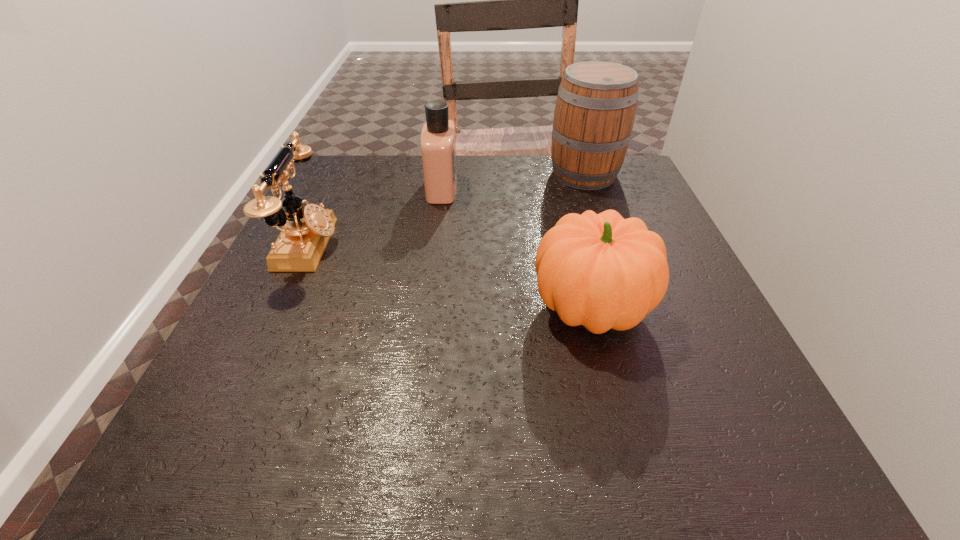
In order to click on object that is the third closest to the cider in this screenshot , I will do `click(305, 232)`.

Find the location of a particular element. the second closest object to the pumpkin is located at coordinates (595, 110).

I want to click on vacant region that satisfies the following two spatial constraints: 1. on the back side of the cider; 2. on the left side of the pumpkin, so click(557, 174).

Find the location of a particular element. free space that satisfies the following two spatial constraints: 1. on the front label of the pumpkin; 2. on the left side of the second object from left to right is located at coordinates (427, 308).

Identify the location of vacant position in the image that satisfies the following two spatial constraints: 1. on the back side of the pumpkin; 2. on the dial of the leftmost object. This screenshot has height=540, width=960. [x=575, y=245].

At what (x,y) coordinates should I click in order to perform the action: click on vacant space that satisfies the following two spatial constraints: 1. on the dial of the telephone; 2. on the left side of the pumpkin. Please return your answer as a coordinate pair (x, y). The width and height of the screenshot is (960, 540). Looking at the image, I should click on (279, 308).

The width and height of the screenshot is (960, 540). Find the location of `free space that satisfies the following two spatial constraints: 1. on the back side of the pumpkin; 2. on the dial of the telephone`. free space that satisfies the following two spatial constraints: 1. on the back side of the pumpkin; 2. on the dial of the telephone is located at coordinates (575, 245).

This screenshot has width=960, height=540. Find the location of `vacant space that satisfies the following two spatial constraints: 1. on the dial of the pumpkin; 2. on the left side of the leftmost object`. vacant space that satisfies the following two spatial constraints: 1. on the dial of the pumpkin; 2. on the left side of the leftmost object is located at coordinates (279, 308).

Where is `free space that satisfies the following two spatial constraints: 1. on the front label of the perfume; 2. on the left side of the pumpkin`? free space that satisfies the following two spatial constraints: 1. on the front label of the perfume; 2. on the left side of the pumpkin is located at coordinates (427, 308).

Identify the location of free space that satisfies the following two spatial constraints: 1. on the front label of the pumpkin; 2. on the right side of the second object from left to right. This screenshot has width=960, height=540. (427, 308).